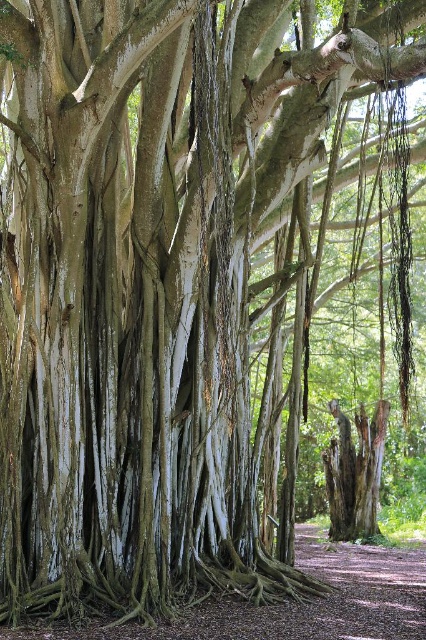
You are a hiker walking along the brown dirt path at lower center and want to reach the smooth gray bark at center. Which direction should you move towards?

You should move to the right because the brown dirt path at lower center is to the left of the smooth gray bark at center, so moving right will bring you closer to the smooth gray bark at center.

You are a hiker carrying a backpack and need to walk along the brown dirt path at lower center while avoiding the smooth gray bark at center. Is the path wide enough for you to walk on without touching the bark?

The brown dirt path at lower center is wider than the smooth gray bark at center, so yes, the path is wide enough for you to walk on without touching the bark.